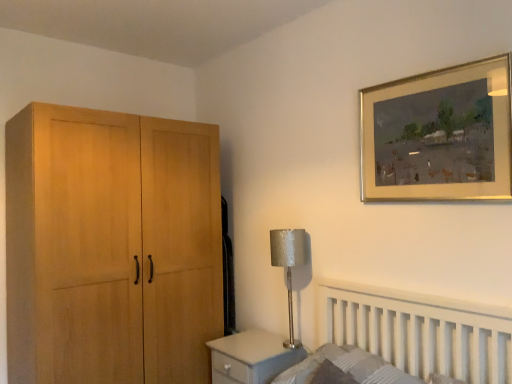
In order to face silver textured lampshade at center-right, should I rotate leftwards or rightwards?

Rotate right and turn 4.280 degrees.

Identify the location of matte gray changing table at lower center. (251, 357).

Could you tell me if matte gray changing table at lower center is facing silver textured lampshade at center-right?

No, matte gray changing table at lower center is not turned towards silver textured lampshade at center-right.

Considering the relative positions of matte gray changing table at lower center and silver textured lampshade at center-right in the image provided, is matte gray changing table at lower center to the left or to the right of silver textured lampshade at center-right?

matte gray changing table at lower center is to the left of silver textured lampshade at center-right.

Based on the photo, from the image's perspective, which one is positioned lower, matte gray changing table at lower center or silver textured lampshade at center-right?

matte gray changing table at lower center, from the image's perspective.

Can you tell me how much matte gray changing table at lower center and silver textured lampshade at center-right differ in facing direction?

The angular difference between matte gray changing table at lower center and silver textured lampshade at center-right is 0.303 degrees.

What are the coordinates of `changing table directly beneath the textured gray mattress at lower right (from a real-world perspective)` in the screenshot? It's located at (251, 357).

Is textured gray mattress at lower right touching matte gray changing table at lower center?

No, textured gray mattress at lower right is not next to matte gray changing table at lower center.

From the picture: Does textured gray mattress at lower right turn towards matte gray changing table at lower center?

No, textured gray mattress at lower right is not facing towards matte gray changing table at lower center.

Is matte gray changing table at lower center completely or partially inside textured gray mattress at lower right?

Definitely not — matte gray changing table at lower center is not inside textured gray mattress at lower right.

Which of these two, textured gray mattress at lower right or gold-framed painting at upper right, stands shorter?

With less height is textured gray mattress at lower right.

From a real-world perspective, who is located lower, textured gray mattress at lower right or gold-framed painting at upper right?

textured gray mattress at lower right is physically lower.

From the image's perspective, is textured gray mattress at lower right on gold-framed painting at upper right?

No, from the image's perspective, textured gray mattress at lower right is not over gold-framed painting at upper right.

At what (x,y) coordinates should I click in order to perform the action: click on picture frame above the silver textured lampshade at center-right (from the image's perspective). Please return your answer as a coordinate pair (x, y). Image resolution: width=512 pixels, height=384 pixels. Looking at the image, I should click on (439, 135).

Is point (303, 264) positioned before point (456, 153)?

No, (303, 264) is behind (456, 153).

Can you tell me how much silver textured lampshade at center-right and gold-framed painting at upper right differ in facing direction?

silver textured lampshade at center-right and gold-framed painting at upper right are facing 0.0173 degrees away from each other.

How far apart are silver textured lampshade at center-right and gold-framed painting at upper right?

silver textured lampshade at center-right is 29.92 inches from gold-framed painting at upper right.

Does silver textured lampshade at center-right have a lesser height compared to textured gray mattress at lower right?

Incorrect, the height of silver textured lampshade at center-right does not fall short of that of textured gray mattress at lower right.

Are silver textured lampshade at center-right and textured gray mattress at lower right beside each other?

There is a gap between silver textured lampshade at center-right and textured gray mattress at lower right.

Which object is positioned more to the right, gold-framed painting at upper right or textured gray mattress at lower right?

gold-framed painting at upper right is more to the right.

Where is `mattress directly beneath the gold-framed painting at upper right (from a real-world perspective)`? mattress directly beneath the gold-framed painting at upper right (from a real-world perspective) is located at coordinates (344, 368).

Are gold-framed painting at upper right and textured gray mattress at lower right beside each other?

No, gold-framed painting at upper right is not next to textured gray mattress at lower right.

How much distance is there between matte gray changing table at lower center and textured gray mattress at lower right?

matte gray changing table at lower center is 14.47 inches from textured gray mattress at lower right.

Is textured gray mattress at lower right a part of matte gray changing table at lower center?

No.

Based on the photo, who is taller, matte gray changing table at lower center or textured gray mattress at lower right?

matte gray changing table at lower center.

Locate an element on the screen. mattress above the matte gray changing table at lower center (from the image's perspective) is located at coordinates (344, 368).

This screenshot has height=384, width=512. I want to click on table lamp on the right of the matte gray changing table at lower center, so click(x=289, y=265).

This screenshot has width=512, height=384. What are the coordinates of `mattress above the matte gray changing table at lower center (from the image's perspective)` in the screenshot? It's located at (344, 368).

Looking at the image, which one is located further to textured gray mattress at lower right, gold-framed painting at upper right or matte gray changing table at lower center?

Based on the image, gold-framed painting at upper right appears to be further to textured gray mattress at lower right.

Which object lies nearer to the anchor point silver textured lampshade at center-right, gold-framed painting at upper right or textured gray mattress at lower right?

Based on the image, textured gray mattress at lower right appears to be nearer to silver textured lampshade at center-right.

Estimate the real-world distances between objects in this image. Which object is further from matte gray changing table at lower center, gold-framed painting at upper right or textured gray mattress at lower right?

The object further to matte gray changing table at lower center is gold-framed painting at upper right.

Looking at the image, which one is located further to textured gray mattress at lower right, matte gray changing table at lower center or silver textured lampshade at center-right?

Among the two, silver textured lampshade at center-right is located further to textured gray mattress at lower right.

Estimate the real-world distances between objects in this image. Which object is further from silver textured lampshade at center-right, textured gray mattress at lower right or matte gray changing table at lower center?

textured gray mattress at lower right is further to silver textured lampshade at center-right.

Considering their positions, is silver textured lampshade at center-right positioned closer to textured gray mattress at lower right than gold-framed painting at upper right?

silver textured lampshade at center-right lies closer to textured gray mattress at lower right than the other object.

When comparing their distances from matte gray changing table at lower center, does gold-framed painting at upper right or silver textured lampshade at center-right seem further?

gold-framed painting at upper right is positioned further to the anchor matte gray changing table at lower center.

Estimate the real-world distances between objects in this image. Which object is closer to textured gray mattress at lower right, gold-framed painting at upper right or silver textured lampshade at center-right?

silver textured lampshade at center-right is positioned closer to the anchor textured gray mattress at lower right.

Where is `table lamp between gold-framed painting at upper right and textured gray mattress at lower right in the up-down direction`? table lamp between gold-framed painting at upper right and textured gray mattress at lower right in the up-down direction is located at coordinates [x=289, y=265].

The width and height of the screenshot is (512, 384). In order to click on changing table between textured gray mattress at lower right and silver textured lampshade at center-right in the front-back direction in this screenshot , I will do `click(251, 357)`.

This screenshot has width=512, height=384. I want to click on mattress that lies between gold-framed painting at upper right and matte gray changing table at lower center from top to bottom, so click(x=344, y=368).

Where is `table lamp between gold-framed painting at upper right and matte gray changing table at lower center in the up-down direction`? table lamp between gold-framed painting at upper right and matte gray changing table at lower center in the up-down direction is located at coordinates (289, 265).